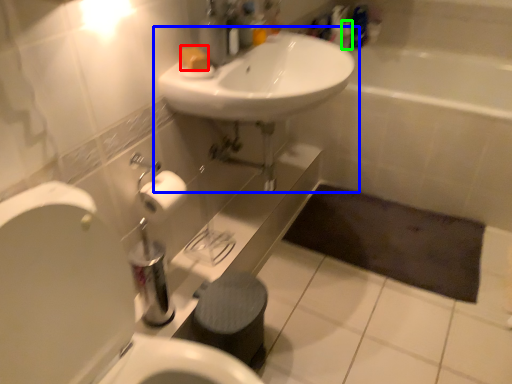
Question: Considering the real-world distances, which object is closest to soap (highlighted by a red box)? sink (highlighted by a blue box) or toiletry (highlighted by a green box).

Choices:
 (A) sink
 (B) toiletry

Answer: (A)